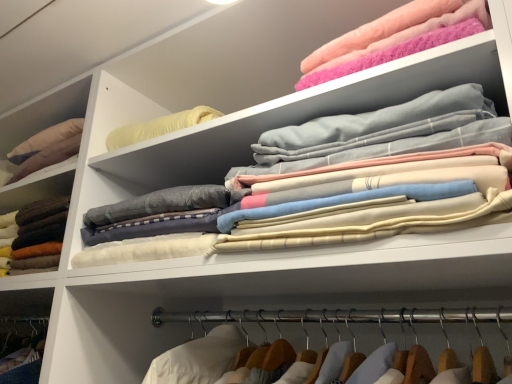
Question: From the image's perspective, is soft wool sweater at left, which is the 3th clothing from right to left, under soft cotton sheets at upper center, marked as the 2th clothing in a right-to-left arrangement?

Choices:
 (A) yes
 (B) no

Answer: (A)

Question: Is soft wool sweater at left, placed as the 1th clothing when sorted from left to right, far from soft cotton sheets at upper center, marked as the 2th clothing in a right-to-left arrangement?

Choices:
 (A) yes
 (B) no

Answer: (B)

Question: From a real-world perspective, is soft wool sweater at left, which is the 3th clothing from right to left, below soft cotton sheets at upper center, marked as the 2th clothing in a right-to-left arrangement?

Choices:
 (A) no
 (B) yes

Answer: (B)

Question: Is soft wool sweater at left, placed as the 1th clothing when sorted from left to right, facing towards soft cotton sheets at upper center, the 2th clothing when ordered from left to right?

Choices:
 (A) yes
 (B) no

Answer: (B)

Question: From a real-world perspective, is soft wool sweater at left, which is the 3th clothing from right to left, on soft cotton sheets at upper center, the 2th clothing when ordered from left to right?

Choices:
 (A) yes
 (B) no

Answer: (B)

Question: Based on their positions, is soft cotton sheets at upper center, marked as the 2th clothing in a right-to-left arrangement, located to the left or right of soft wool sweater at left, placed as the 1th clothing when sorted from left to right?

Choices:
 (A) left
 (B) right

Answer: (B)

Question: From the image's perspective, is soft cotton sheets at upper center, the 2th clothing when ordered from left to right, located above or below soft wool sweater at left, placed as the 1th clothing when sorted from left to right?

Choices:
 (A) above
 (B) below

Answer: (A)

Question: Relative to soft wool sweater at left, which is the 3th clothing from right to left, is soft cotton sheets at upper center, the 2th clothing when ordered from left to right, in front or behind?

Choices:
 (A) behind
 (B) front

Answer: (B)

Question: Is point (301, 221) closer or farther from the camera than point (67, 201)?

Choices:
 (A) closer
 (B) farther

Answer: (A)

Question: Relative to fluffy pink towel at upper right, marked as the third clothing in a left-to-right arrangement, is soft wool sweater at left, placed as the 1th clothing when sorted from left to right, in front or behind?

Choices:
 (A) behind
 (B) front

Answer: (A)

Question: From the image's perspective, is soft wool sweater at left, which is the 3th clothing from right to left, positioned above or below fluffy pink towel at upper right, marked as the third clothing in a left-to-right arrangement?

Choices:
 (A) below
 (B) above

Answer: (A)

Question: Is soft wool sweater at left, placed as the 1th clothing when sorted from left to right, inside or outside of fluffy pink towel at upper right, marked as the third clothing in a left-to-right arrangement?

Choices:
 (A) outside
 (B) inside

Answer: (A)

Question: Based on their sizes in the image, would you say soft wool sweater at left, placed as the 1th clothing when sorted from left to right, is bigger or smaller than fluffy pink towel at upper right, marked as the third clothing in a left-to-right arrangement?

Choices:
 (A) small
 (B) big

Answer: (B)

Question: Based on their sizes in the image, would you say soft wool sweater at left, placed as the 1th clothing when sorted from left to right, is bigger or smaller than soft cotton sheets at upper center, the 2th clothing when ordered from left to right?

Choices:
 (A) big
 (B) small

Answer: (B)

Question: Is soft wool sweater at left, placed as the 1th clothing when sorted from left to right, to the left or to the right of soft cotton sheets at upper center, the 2th clothing when ordered from left to right, in the image?

Choices:
 (A) right
 (B) left

Answer: (B)